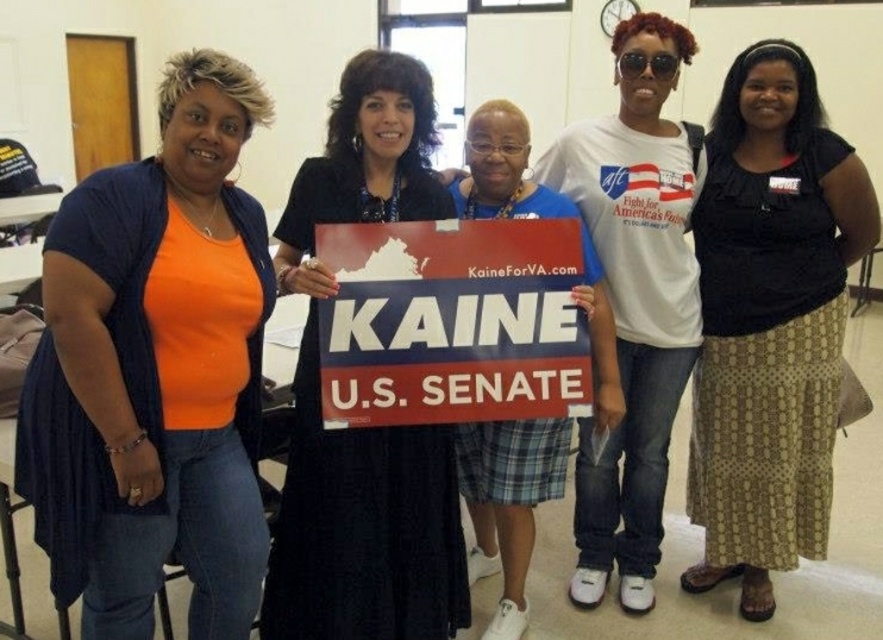
Does matte plastic sign at center have a greater height compared to blue plaid skirt at center?

No.

What are the coordinates of `matte plastic sign at center` in the screenshot? It's located at (451, 323).

The width and height of the screenshot is (883, 640). Find the location of `matte plastic sign at center`. matte plastic sign at center is located at coordinates (451, 323).

Is black fabric sign at center wider than matte plastic sign at center?

No.

What do you see at coordinates (366, 428) in the screenshot? I see `black fabric sign at center` at bounding box center [366, 428].

Identify the location of black fabric sign at center. (366, 428).

The height and width of the screenshot is (640, 883). I want to click on black fabric sign at center, so click(x=366, y=428).

Does orange matte shirt at left have a greater width compared to matte plastic sign at center?

Incorrect, orange matte shirt at left's width does not surpass matte plastic sign at center's.

Between orange matte shirt at left and matte plastic sign at center, which one appears on the left side from the viewer's perspective?

orange matte shirt at left

Between point (91, 637) and point (565, 330), which one is positioned in front?

Point (91, 637)

At what (x,y) coordinates should I click in order to perform the action: click on orange matte shirt at left. Please return your answer as a coordinate pair (x, y). The width and height of the screenshot is (883, 640). Looking at the image, I should click on (155, 371).